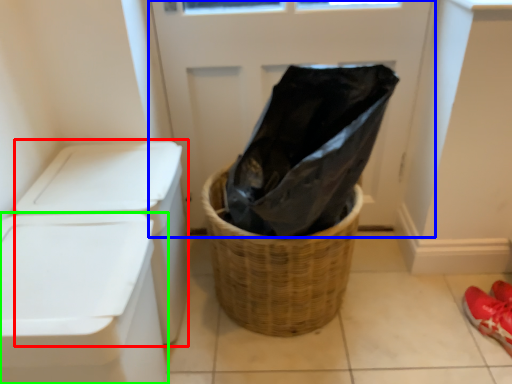
Question: Estimate the real-world distances between objects in this image. Which object is closer to washer (highlighted by a red box), screen door (highlighted by a blue box) or waste container (highlighted by a green box)?

Choices:
 (A) screen door
 (B) waste container

Answer: (B)